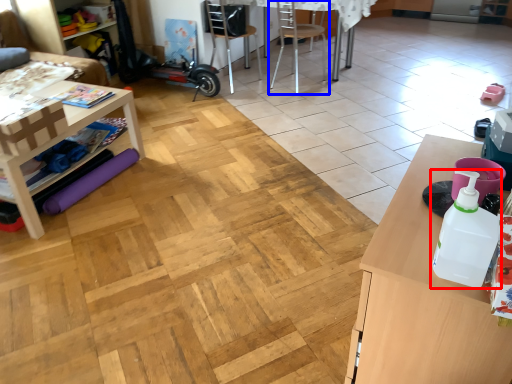
Question: Which object appears closest to the camera in this image, bottle (highlighted by a red box) or chair (highlighted by a blue box)?

Choices:
 (A) bottle
 (B) chair

Answer: (A)